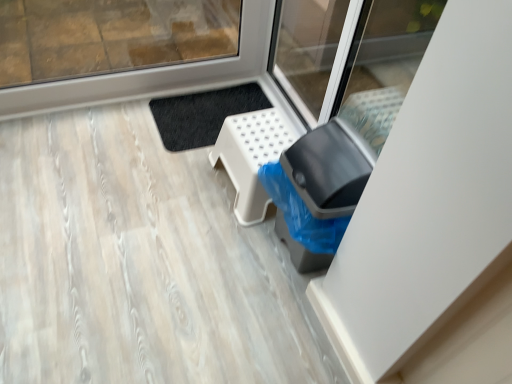
Question: Is black plastic trash can at lower right taller or shorter than white plastic stool at lower center?

Choices:
 (A) short
 (B) tall

Answer: (B)

Question: In the image, is black plastic trash can at lower right positioned in front of or behind white plastic stool at lower center?

Choices:
 (A) behind
 (B) front

Answer: (B)

Question: Is black plastic trash can at lower right spatially inside white plastic stool at lower center, or outside of it?

Choices:
 (A) inside
 (B) outside

Answer: (B)

Question: Is white plastic stool at lower center taller or shorter than black plastic trash can at lower right?

Choices:
 (A) short
 (B) tall

Answer: (A)

Question: Is white plastic stool at lower center inside the boundaries of black plastic trash can at lower right, or outside?

Choices:
 (A) outside
 (B) inside

Answer: (A)

Question: Is white plastic stool at lower center wider or thinner than black plastic trash can at lower right?

Choices:
 (A) wide
 (B) thin

Answer: (A)

Question: Visually, is white plastic stool at lower center positioned to the left or to the right of black plastic trash can at lower right?

Choices:
 (A) left
 (B) right

Answer: (A)